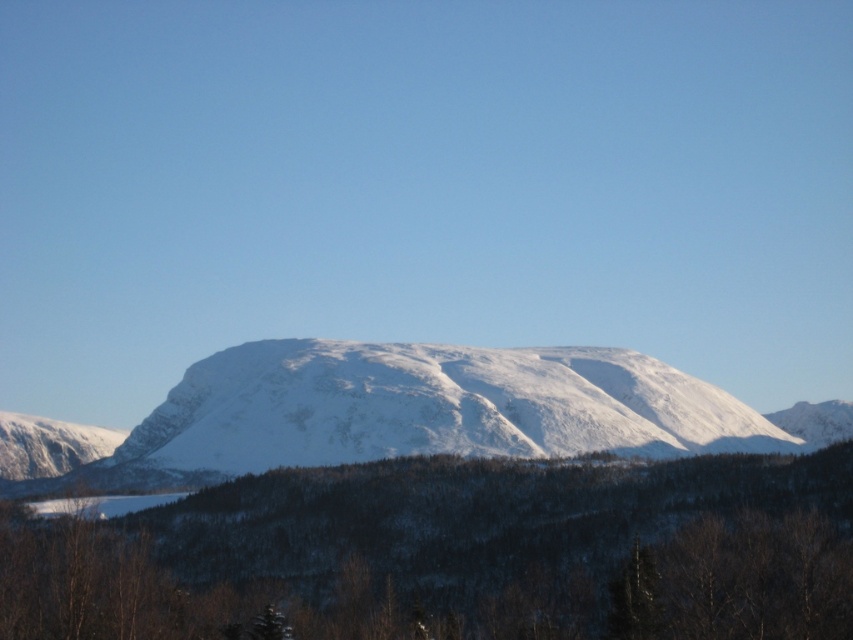
Question: Is green matte tree at center to the right of white snow-covered mountain at center from the viewer's perspective?

Choices:
 (A) no
 (B) yes

Answer: (B)

Question: Can you confirm if green matte tree at center is positioned below white snow-covered mountain at center?

Choices:
 (A) yes
 (B) no

Answer: (A)

Question: Which point is farther to the camera?

Choices:
 (A) (190, 477)
 (B) (625, 579)

Answer: (A)

Question: Which object is closer to the camera taking this photo?

Choices:
 (A) white snow-covered mountain at center
 (B) green matte tree at center

Answer: (B)

Question: Can you confirm if green matte tree at center is positioned above white snow-covered mountain at center?

Choices:
 (A) no
 (B) yes

Answer: (A)